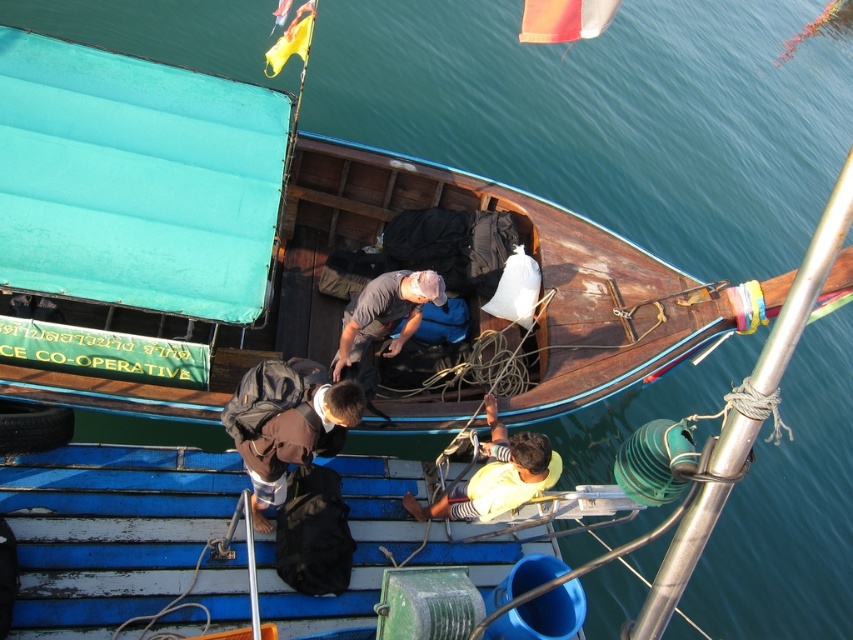
Question: Does yellow matte shirt at center appear on the left side of gray matte shirt at center?

Choices:
 (A) no
 (B) yes

Answer: (A)

Question: Considering the relative positions of yellow matte shirt at center and gray matte shirt at center in the image provided, where is yellow matte shirt at center located with respect to gray matte shirt at center?

Choices:
 (A) above
 (B) below

Answer: (B)

Question: Can you confirm if yellow matte shirt at center is thinner than gray matte shirt at center?

Choices:
 (A) yes
 (B) no

Answer: (B)

Question: Which object appears closest to the camera in this image?

Choices:
 (A) gray matte shirt at center
 (B) yellow matte shirt at center

Answer: (B)